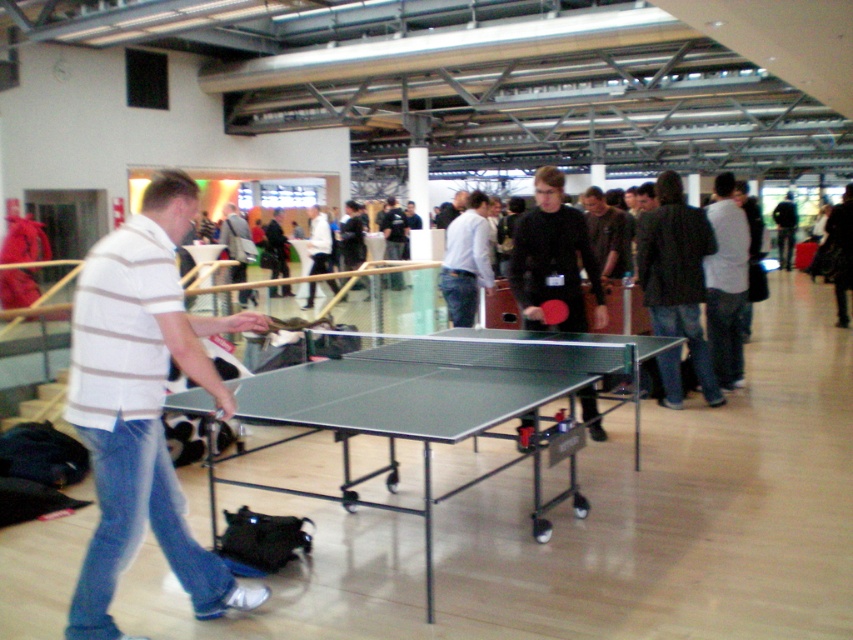
The width and height of the screenshot is (853, 640). Find the location of `white striped shirt at left`. white striped shirt at left is located at coordinates (142, 404).

Looking at this image, is white striped shirt at left further to camera compared to green rubber table tennis table at center?

No, it is in front of green rubber table tennis table at center.

Describe the element at coordinates (142, 404) in the screenshot. I see `white striped shirt at left` at that location.

You are a GUI agent. You are given a task and a screenshot of the screen. Output one action in this format:
    pyautogui.click(x=<x>, y=<y>)
    Task: Click on the white striped shirt at left
    The image size is (853, 640).
    Given the screenshot: What is the action you would take?
    pyautogui.click(x=142, y=404)

Does green rubber table at center have a smaller size compared to green rubber table tennis table at center?

No, green rubber table at center is not smaller than green rubber table tennis table at center.

Is green rubber table at center below green rubber table tennis table at center?

Correct, green rubber table at center is located below green rubber table tennis table at center.

Describe the element at coordinates (438, 404) in the screenshot. I see `green rubber table at center` at that location.

Locate an element on the screen. Image resolution: width=853 pixels, height=640 pixels. green rubber table at center is located at coordinates (438, 404).

Does point (538, 257) come behind point (560, 317)?

Yes, point (538, 257) is behind point (560, 317).

Which of these two, matte black ping pong paddle at center or green rubber table tennis table at center, stands taller?

matte black ping pong paddle at center is taller.

Is point (561, 288) positioned before point (531, 307)?

No.

Find the location of a particular element. The width and height of the screenshot is (853, 640). matte black ping pong paddle at center is located at coordinates (554, 253).